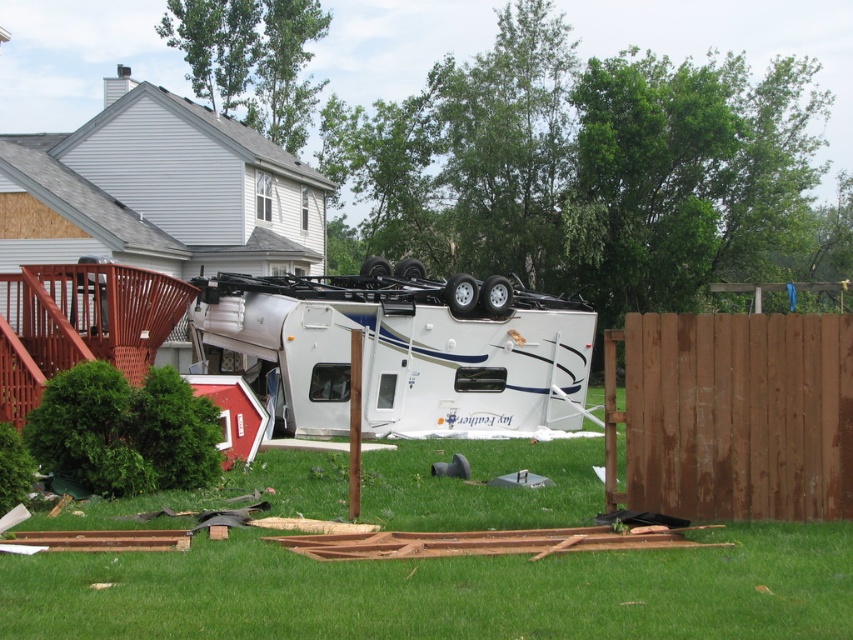
You are a drone operator tasked with assessing the damage in the backyard. You need to determine the safest path for a delivery drone to land. The drone requires a landing area that is wider than the brown wooden fence at right. Can the green grass at center provide a suitable landing spot?

The green grass at center has a larger width than the brown wooden fence at right, so it can provide a suitable landing spot for the delivery drone since its width meets the required space.

Looking at this image, you are a drone operator tasked with assessing the damage in the backyard. You notice the green grass at center and the brown wooden fence at right. Which object is closer to the ground?

The green grass at center is positioned under the brown wooden fence at right, so it is closer to the ground.